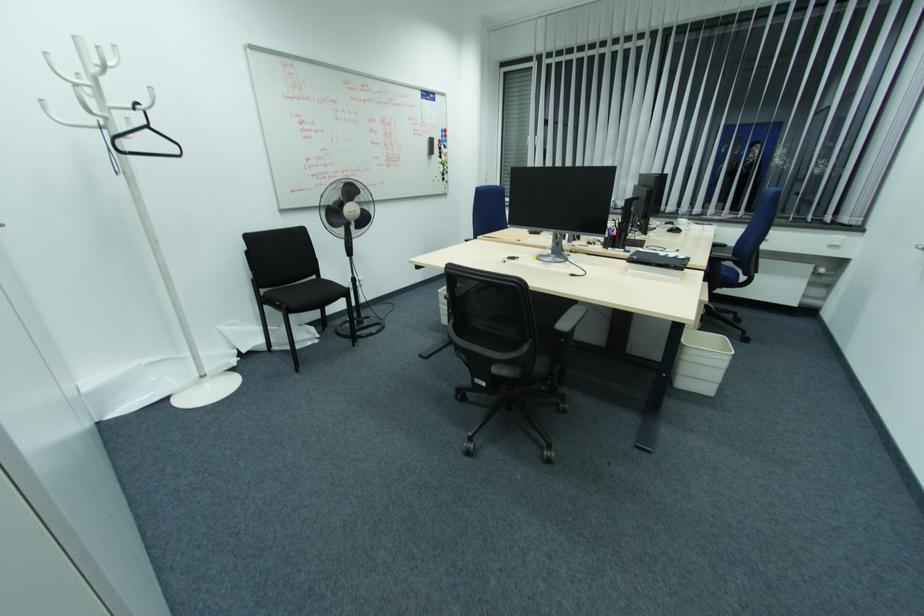
This screenshot has height=616, width=924. Identify the location of white coat stand hook. (149, 99).